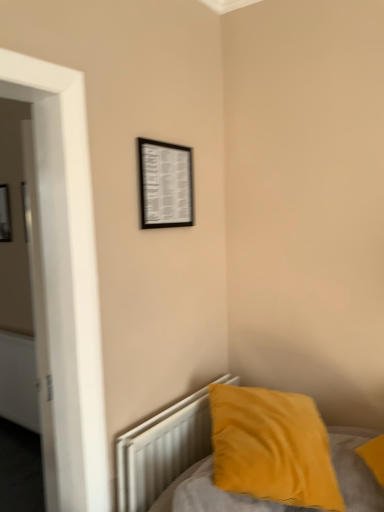
Question: Considering the relative positions of white metallic radiator at lower right and black matte picture frame at upper left, the second picture frame in the right-to-left sequence, in the image provided, is white metallic radiator at lower right to the right of black matte picture frame at upper left, the second picture frame in the right-to-left sequence, from the viewer's perspective?

Choices:
 (A) no
 (B) yes

Answer: (B)

Question: Is white metallic radiator at lower right oriented towards black matte picture frame at upper left, which is the 1th picture frame in back-to-front order?

Choices:
 (A) yes
 (B) no

Answer: (B)

Question: Is white metallic radiator at lower right touching black matte picture frame at upper left, the second picture frame in the right-to-left sequence?

Choices:
 (A) no
 (B) yes

Answer: (A)

Question: Is white metallic radiator at lower right outside black matte picture frame at upper left, arranged as the 2th picture frame when viewed from the front?

Choices:
 (A) yes
 (B) no

Answer: (A)

Question: Can you confirm if white metallic radiator at lower right is smaller than black matte picture frame at upper left, which is counted as the 1th picture frame, starting from the left?

Choices:
 (A) yes
 (B) no

Answer: (B)

Question: From a real-world perspective, is white metallic radiator at lower right physically located above or below black matte picture frame at upper center, acting as the first picture frame starting from the right?

Choices:
 (A) below
 (B) above

Answer: (A)

Question: From the image's perspective, is white metallic radiator at lower right positioned above or below black matte picture frame at upper center, the 1th picture frame in the front-to-back sequence?

Choices:
 (A) above
 (B) below

Answer: (B)

Question: Is point (157, 452) closer or farther from the camera than point (165, 188)?

Choices:
 (A) closer
 (B) farther

Answer: (A)

Question: Looking at their shapes, would you say white metallic radiator at lower right is wider or thinner than black matte picture frame at upper center, acting as the first picture frame starting from the right?

Choices:
 (A) wide
 (B) thin

Answer: (A)

Question: Does point (288, 445) appear closer or farther from the camera than point (183, 206)?

Choices:
 (A) farther
 (B) closer

Answer: (B)

Question: Based on their sizes in the image, would you say velvet yellow pillow at lower right is bigger or smaller than black matte picture frame at upper center, which ranks as the second picture frame in back-to-front order?

Choices:
 (A) small
 (B) big

Answer: (B)

Question: Based on their positions, is velvet yellow pillow at lower right located to the left or right of black matte picture frame at upper center, which ranks as the second picture frame in back-to-front order?

Choices:
 (A) right
 (B) left

Answer: (A)

Question: From a real-world perspective, is velvet yellow pillow at lower right positioned above or below black matte picture frame at upper center, acting as the second picture frame starting from the left?

Choices:
 (A) above
 (B) below

Answer: (B)

Question: Is point (203, 409) closer or farther from the camera than point (150, 224)?

Choices:
 (A) farther
 (B) closer

Answer: (A)

Question: Is velvet yellow pillow at lower right wider or thinner than black matte picture frame at upper center, the 1th picture frame in the front-to-back sequence?

Choices:
 (A) wide
 (B) thin

Answer: (A)